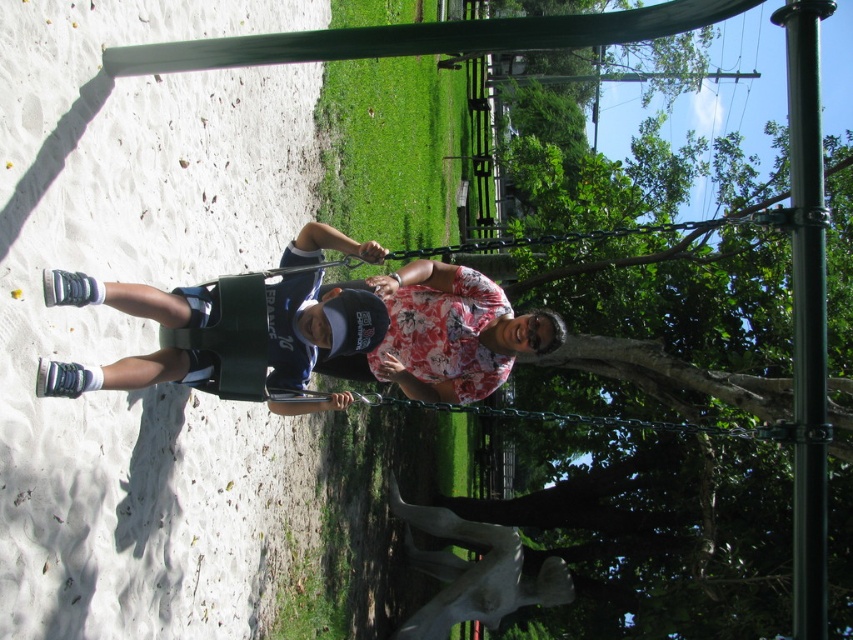
You are a parent at the playground and want to move the matte green wheelchair at left closer to the green metallic pole at right. Which direction should you push the wheelchair to get it closer to the pole?

The matte green wheelchair at left is positioned on the left side of the green metallic pole at right. To move it closer, you should push the wheelchair to the right towards the pole.

You are a parent at the playground and want to ensure there is enough space between the matte green wheelchair at left and the green metallic pole at right for your child to walk through. Based on the scene, can the child pass through the space between them?

The matte green wheelchair at left occupies less space than green metallic pole at right, so the space between them is sufficient for the child to pass through.

You are at the playground and want to place a new sandbox between the two points labeled point (271,296) and point (820,483). According to the scene, which point should the sandbox be closer to in order to be placed behind the swing set?

The sandbox should be closer to point (271,296) because it is behind point (820,483), and placing it near that point would position it behind the swing set.